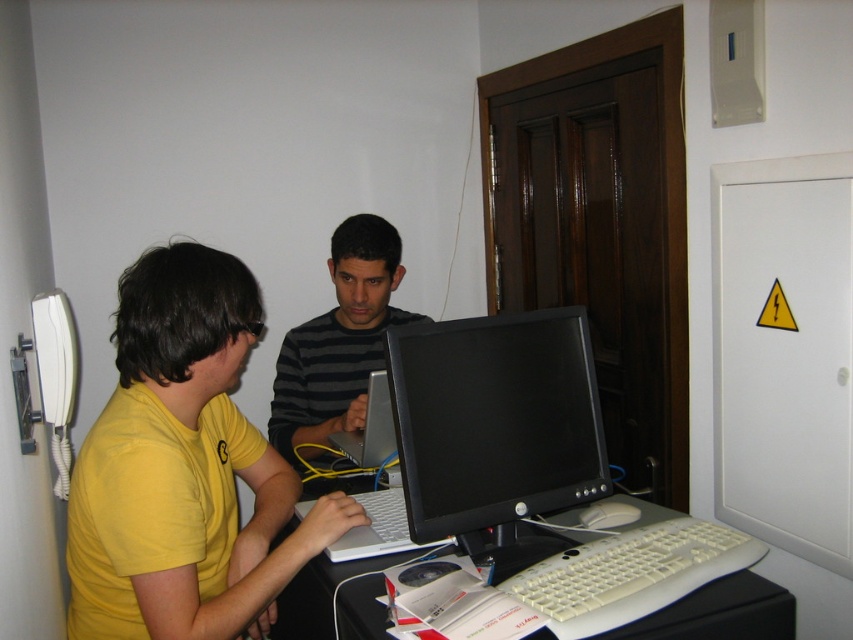
Does point (262, 456) lie behind point (585, 634)?

That is True.

Between point (115, 320) and point (625, 616), which one is positioned behind?

Positioned behind is point (115, 320).

I want to click on yellow matte shirt at left, so click(184, 467).

You are a GUI agent. You are given a task and a screenshot of the screen. Output one action in this format:
    pyautogui.click(x=<x>, y=<y>)
    Task: Click on the yellow matte shirt at left
    This screenshot has height=640, width=853.
    Given the screenshot: What is the action you would take?
    pyautogui.click(x=184, y=467)

Who is shorter, striped sweater at center or white plastic computer desk at center?

white plastic computer desk at center is shorter.

Does striped sweater at center appear over white plastic computer desk at center?

Correct, striped sweater at center is located above white plastic computer desk at center.

Is point (321, 401) positioned in front of point (657, 516)?

No, (321, 401) is further to viewer.

Find the location of `striped sweater at center`. striped sweater at center is located at coordinates (338, 340).

Who is more distant from viewer, (599, 598) or (575, 532)?

The point (575, 532) is behind.

The width and height of the screenshot is (853, 640). Describe the element at coordinates (630, 573) in the screenshot. I see `white plastic keyboard at lower center` at that location.

Find the location of a particular element. This screenshot has height=640, width=853. white plastic keyboard at lower center is located at coordinates (630, 573).